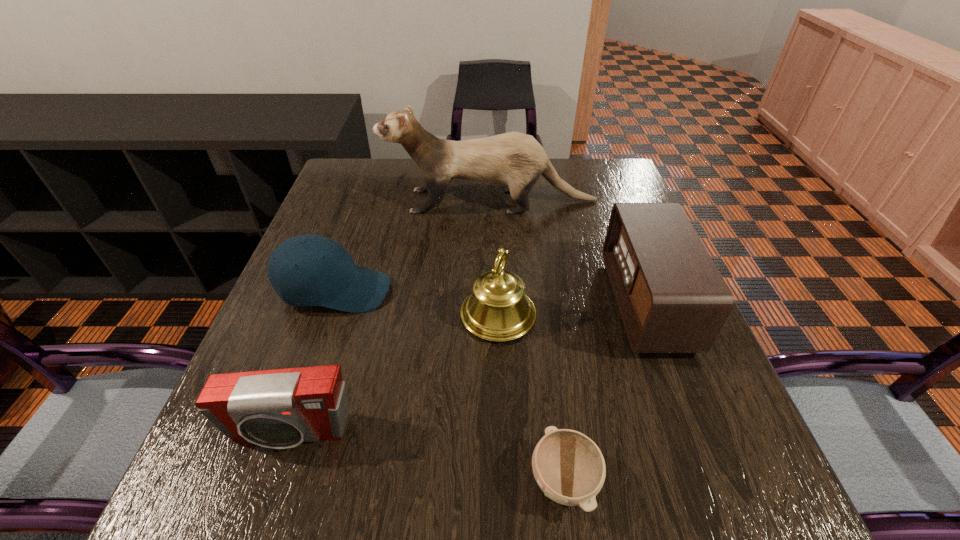
Find the location of a particular element. This screenshot has width=960, height=540. vacant space positioned 0.110m on the front of the bell is located at coordinates (501, 394).

The image size is (960, 540). Identify the location of free point located 0.320m on the front-facing side of the radio receiver. (466, 303).

Where is `free spot located 0.150m on the front-facing side of the radio receiver`? This screenshot has width=960, height=540. free spot located 0.150m on the front-facing side of the radio receiver is located at coordinates (544, 303).

Where is `free space located on the front-facing side of the radio receiver`? The width and height of the screenshot is (960, 540). free space located on the front-facing side of the radio receiver is located at coordinates (484, 303).

Where is `vacant area situated 0.330m on the front-facing side of the baseball cap`? vacant area situated 0.330m on the front-facing side of the baseball cap is located at coordinates (540, 291).

At what (x,y) coordinates should I click in order to perform the action: click on free space located on the front-facing side of the camera. Please return your answer as a coordinate pair (x, y). Looking at the image, I should click on (271, 488).

The height and width of the screenshot is (540, 960). I want to click on vacant area situated 0.110m on the left of the shortest object, so click(x=457, y=481).

This screenshot has height=540, width=960. What are the coordinates of `object present at the far edge` in the screenshot? It's located at (516, 160).

This screenshot has width=960, height=540. Find the location of `object located at the near edge`. object located at the near edge is located at coordinates (568, 466).

Identify the location of baseball cap at the left edge. Image resolution: width=960 pixels, height=540 pixels. (307, 270).